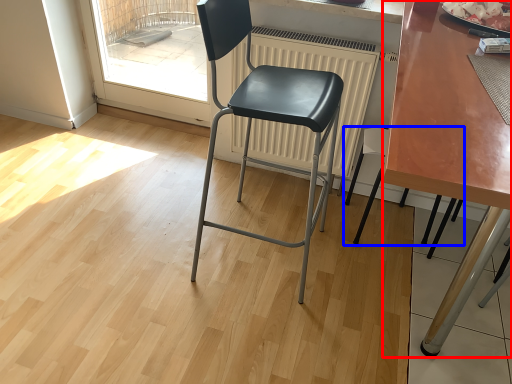
Question: Which of the following is the farthest to the observer, table (highlighted by a red box) or chair (highlighted by a blue box)?

Choices:
 (A) table
 (B) chair

Answer: (B)